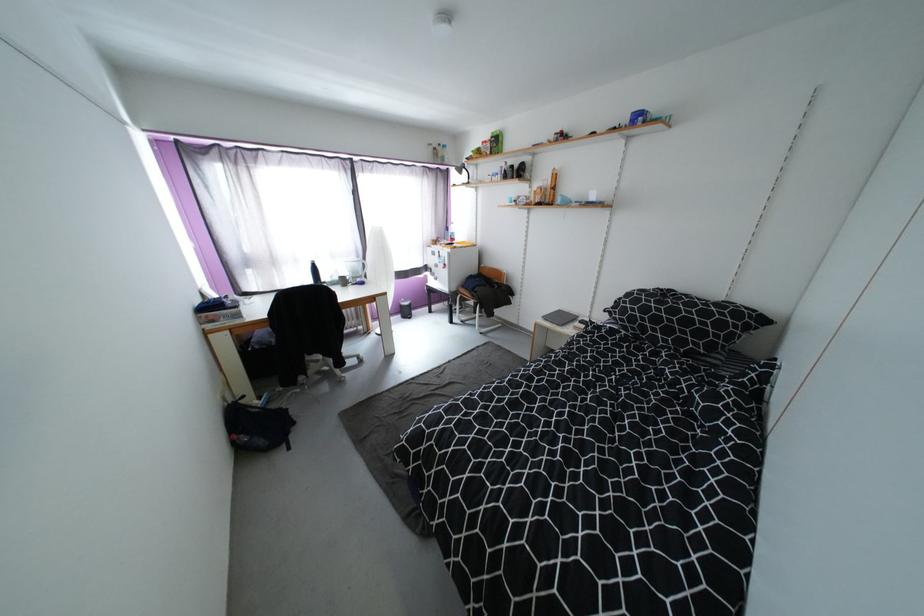
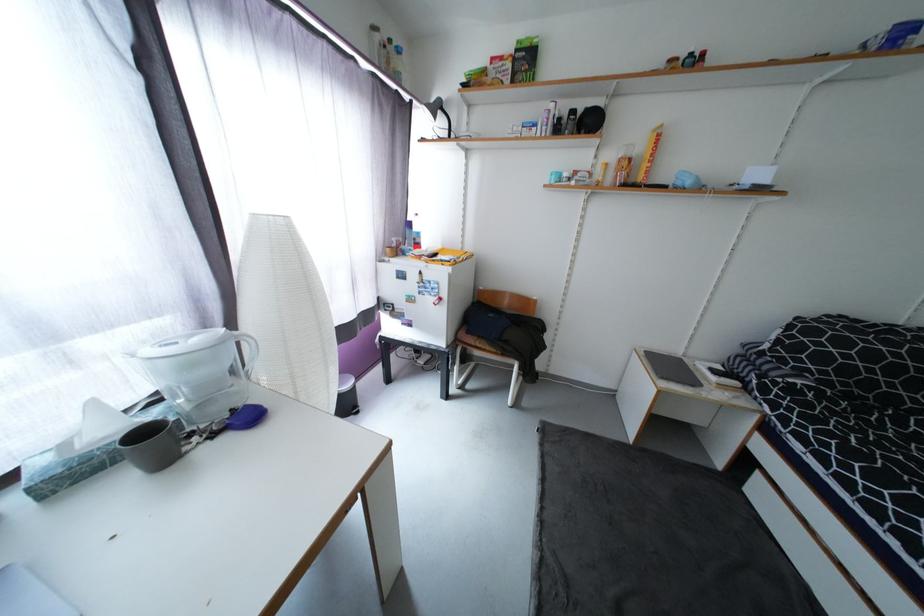
Find the pixel in the second image that matches (x=473, y=296) in the first image.

(493, 349)